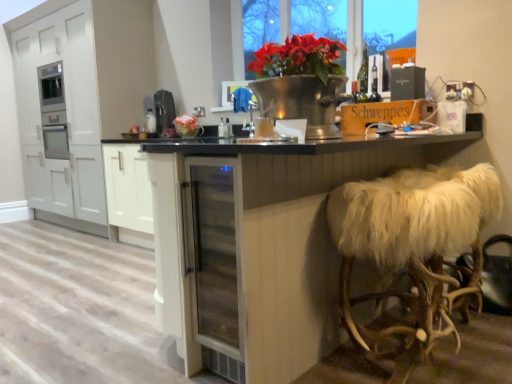
Question: Is the position of transparent glass table at center less distant than that of matte black box at upper right, the second appliance in the back-to-front sequence?

Choices:
 (A) yes
 (B) no

Answer: (A)

Question: Is transparent glass table at center positioned beyond the bounds of matte black box at upper right, the second appliance viewed from the left?

Choices:
 (A) no
 (B) yes

Answer: (B)

Question: Is transparent glass table at center to the left of matte black box at upper right, which is counted as the first appliance, starting from the front, from the viewer's perspective?

Choices:
 (A) yes
 (B) no

Answer: (A)

Question: From the image's perspective, is transparent glass table at center over matte black box at upper right, the second appliance viewed from the left?

Choices:
 (A) no
 (B) yes

Answer: (A)

Question: Does transparent glass table at center have a lesser width compared to matte black box at upper right, which is counted as the first appliance, starting from the front?

Choices:
 (A) no
 (B) yes

Answer: (A)

Question: Can you confirm if transparent glass table at center is shorter than matte black box at upper right, which is the first appliance from right to left?

Choices:
 (A) no
 (B) yes

Answer: (A)

Question: Is red matte flower pot at upper center thinner than matte black box at upper right, which is the first appliance from right to left?

Choices:
 (A) yes
 (B) no

Answer: (A)

Question: Is red matte flower pot at upper center at the left side of matte black box at upper right, the second appliance in the back-to-front sequence?

Choices:
 (A) yes
 (B) no

Answer: (A)

Question: Is red matte flower pot at upper center far from matte black box at upper right, which is counted as the first appliance, starting from the front?

Choices:
 (A) yes
 (B) no

Answer: (B)

Question: Could matte black box at upper right, the second appliance in the back-to-front sequence, be considered to be inside red matte flower pot at upper center?

Choices:
 (A) no
 (B) yes

Answer: (A)

Question: Is red matte flower pot at upper center positioned with its back to matte black box at upper right, which is counted as the first appliance, starting from the front?

Choices:
 (A) no
 (B) yes

Answer: (A)

Question: Considering the relative sizes of red matte flower pot at upper center and matte black box at upper right, the second appliance viewed from the left, in the image provided, is red matte flower pot at upper center wider than matte black box at upper right, the second appliance viewed from the left,?

Choices:
 (A) yes
 (B) no

Answer: (B)

Question: From a real-world perspective, is red matte flower pot at upper center physically above black plastic coffee machine at center, which is counted as the first appliance, starting from the back?

Choices:
 (A) no
 (B) yes

Answer: (B)